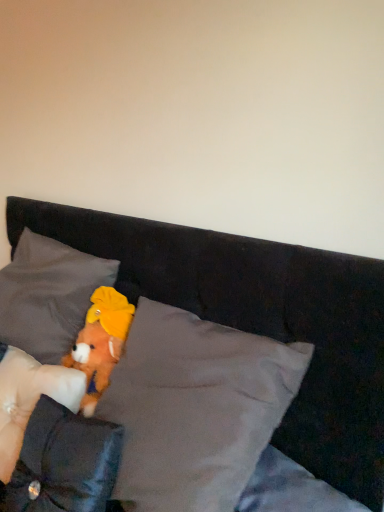
Question: Is fluffy orange teddy bear at center far from velvet gray pillow at lower left, placed as the 3th pillow when sorted from back to front?

Choices:
 (A) yes
 (B) no

Answer: (B)

Question: Does fluffy orange teddy bear at center have a greater width compared to velvet gray pillow at lower left, placed as the 3th pillow when sorted from back to front?

Choices:
 (A) no
 (B) yes

Answer: (A)

Question: Is fluffy orange teddy bear at center taller than velvet gray pillow at lower left, the 1th pillow when ordered from front to back?

Choices:
 (A) yes
 (B) no

Answer: (B)

Question: From a real-world perspective, is fluffy orange teddy bear at center beneath velvet gray pillow at lower left, the 1th pillow when ordered from front to back?

Choices:
 (A) no
 (B) yes

Answer: (A)

Question: From the image's perspective, is fluffy orange teddy bear at center on top of velvet gray pillow at lower left, placed as the 3th pillow when sorted from back to front?

Choices:
 (A) no
 (B) yes

Answer: (B)

Question: Is fluffy orange teddy bear at center next to velvet gray pillow at lower left, placed as the 3th pillow when sorted from back to front, and touching it?

Choices:
 (A) no
 (B) yes

Answer: (A)

Question: From the image's perspective, is velvet gray pillow at lower left, placed as the 3th pillow when sorted from back to front, below fluffy fabric stuffed animal at center?

Choices:
 (A) yes
 (B) no

Answer: (A)

Question: Can you confirm if velvet gray pillow at lower left, placed as the 3th pillow when sorted from back to front, is wider than fluffy fabric stuffed animal at center?

Choices:
 (A) yes
 (B) no

Answer: (B)

Question: From a real-world perspective, does velvet gray pillow at lower left, placed as the 3th pillow when sorted from back to front, sit lower than fluffy fabric stuffed animal at center?

Choices:
 (A) yes
 (B) no

Answer: (A)

Question: Could you tell me if velvet gray pillow at lower left, placed as the 3th pillow when sorted from back to front, is facing fluffy fabric stuffed animal at center?

Choices:
 (A) yes
 (B) no

Answer: (A)

Question: Is velvet gray pillow at lower left, placed as the 3th pillow when sorted from back to front, shorter than fluffy fabric stuffed animal at center?

Choices:
 (A) yes
 (B) no

Answer: (A)

Question: Are velvet gray pillow at lower left, the 1th pillow when ordered from front to back, and fluffy fabric stuffed animal at center far apart?

Choices:
 (A) no
 (B) yes

Answer: (A)

Question: Is dark gray plush pillow at left, which is the first pillow from back to front, aimed at fluffy orange teddy bear at center?

Choices:
 (A) yes
 (B) no

Answer: (B)